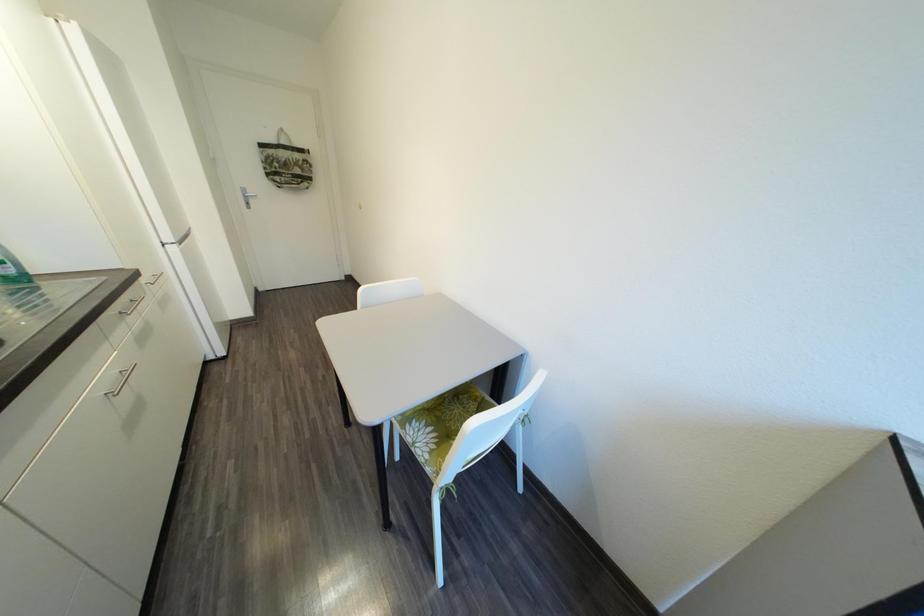
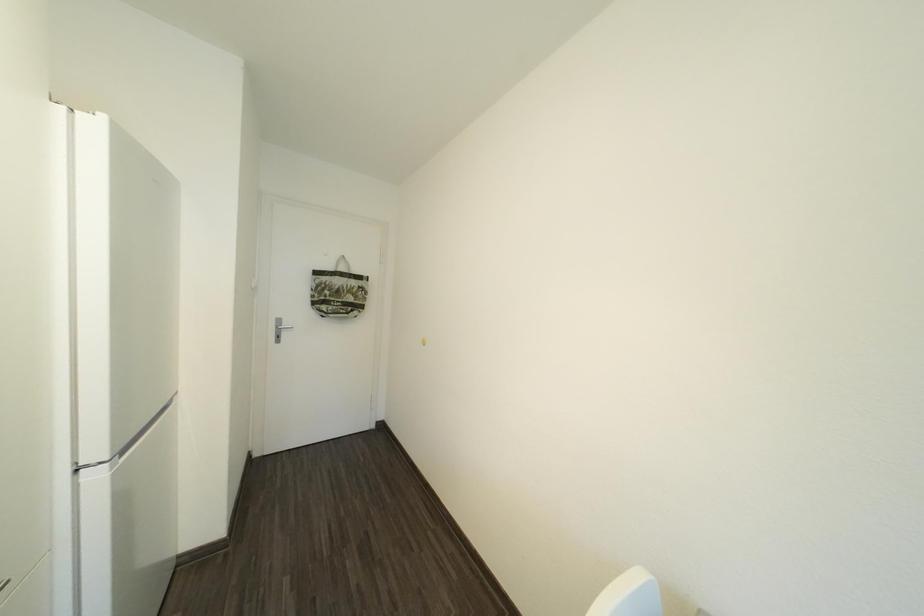
Which direction would the cameraman need to move to produce the second image?

The cameraman moved toward left, forward.